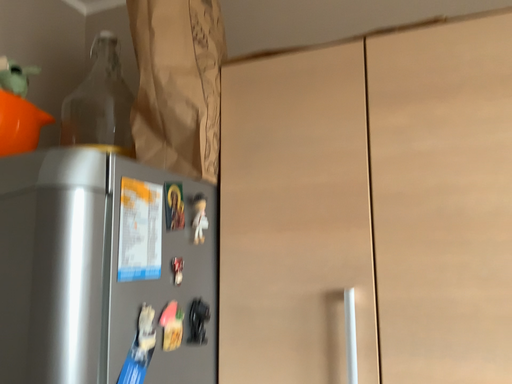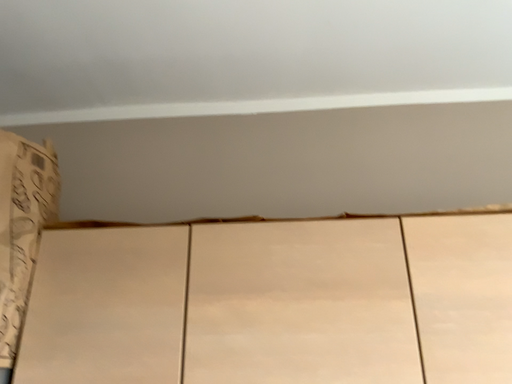
Question: How did the camera likely rotate when shooting the video?

Choices:
 (A) rotated downward
 (B) rotated upward

Answer: (B)